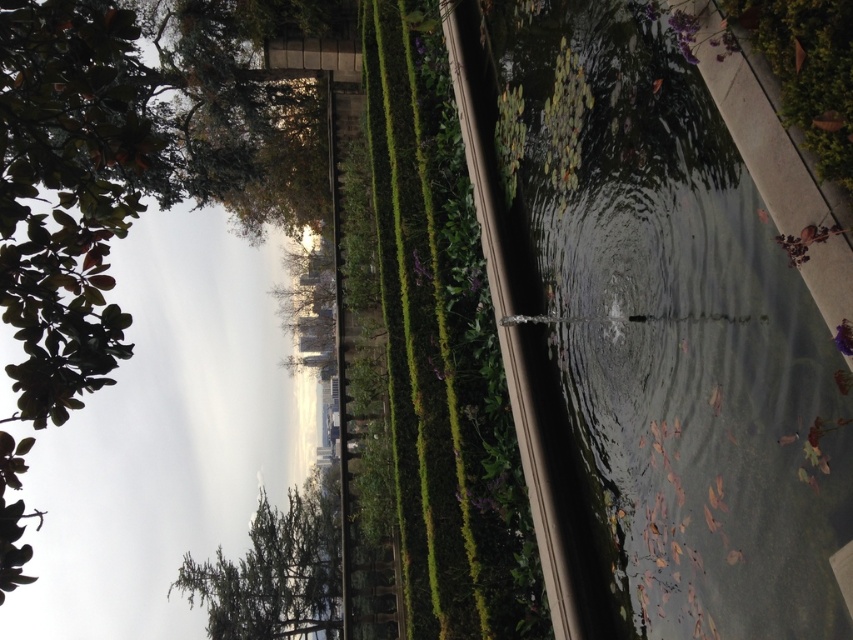
Question: Estimate the real-world distances between objects in this image. Which object is closer to the clear glass pond at center?

Choices:
 (A) green leafy tree at lower left
 (B) green leafy tree at upper left

Answer: (B)

Question: Does clear glass pond at center lie in front of green leafy tree at lower left?

Choices:
 (A) yes
 (B) no

Answer: (A)

Question: Does clear glass pond at center lie behind green leafy tree at lower left?

Choices:
 (A) yes
 (B) no

Answer: (B)

Question: Which object is farther from the camera taking this photo?

Choices:
 (A) clear glass pond at center
 (B) green leafy tree at lower left
 (C) green leafy tree at upper left

Answer: (B)

Question: Considering the relative positions of clear glass pond at center and green leafy tree at upper left in the image provided, where is clear glass pond at center located with respect to green leafy tree at upper left?

Choices:
 (A) below
 (B) above

Answer: (B)

Question: Which object is closer to the camera taking this photo?

Choices:
 (A) clear glass pond at center
 (B) green leafy tree at lower left
 (C) green leafy tree at upper left

Answer: (A)